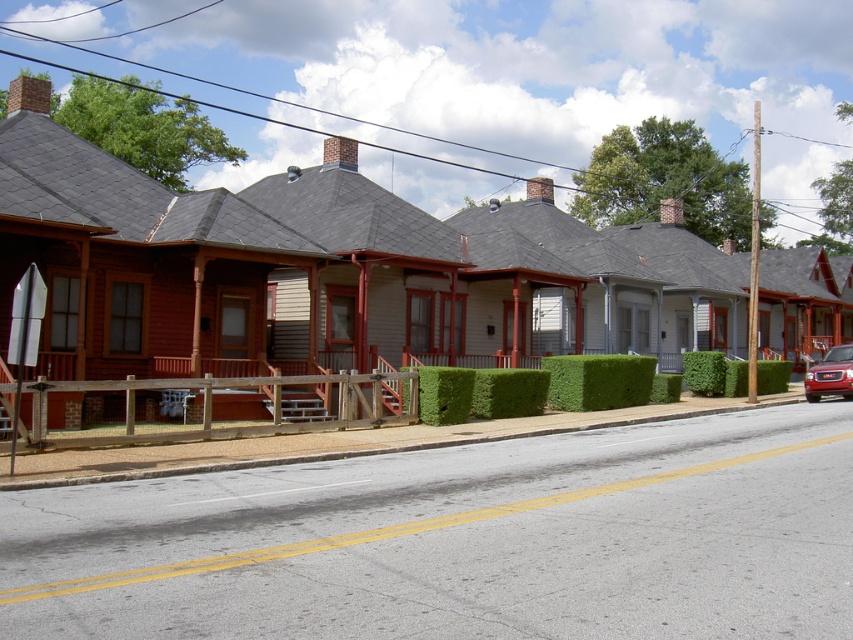
Question: Among these points, which one is farthest from the camera?

Choices:
 (A) (811, 381)
 (B) (337, 192)
 (C) (608, 381)
 (D) (248, 436)

Answer: (B)

Question: Can you confirm if green leafy hedge at center is positioned above shiny red suv at right?

Choices:
 (A) yes
 (B) no

Answer: (B)

Question: From the image, what is the correct spatial relationship of green hedge at center in relation to brown wooden fence at center?

Choices:
 (A) above
 (B) below

Answer: (A)

Question: Can you confirm if brown wooden fence at center is positioned above green leafy hedge at center?

Choices:
 (A) no
 (B) yes

Answer: (A)

Question: Among these points, which one is farthest from the camera?

Choices:
 (A) (88, 259)
 (B) (837, 356)
 (C) (614, 401)
 (D) (39, 404)

Answer: (B)

Question: Which point is farther from the camera taking this photo?

Choices:
 (A) (834, 369)
 (B) (579, 292)

Answer: (B)